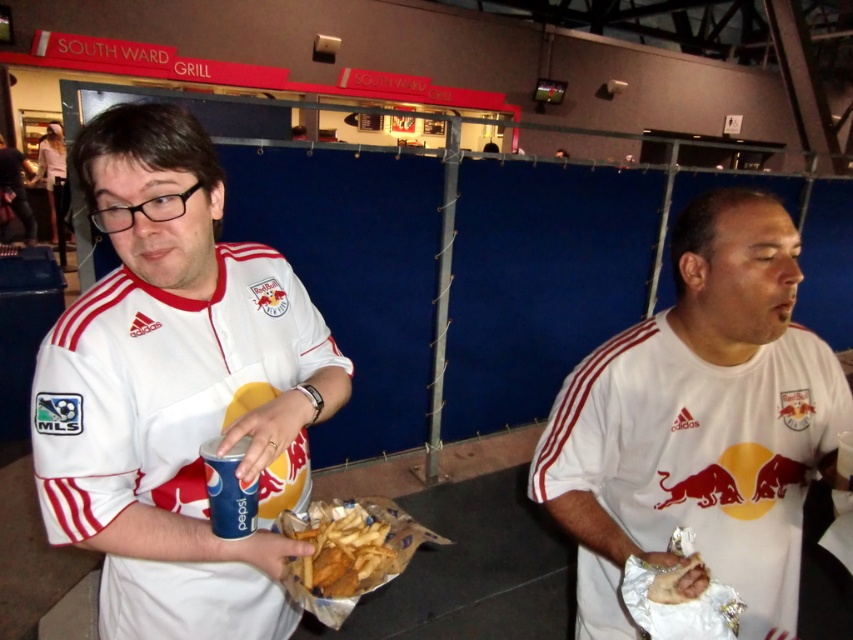
Question: Does white matte shirt at center appear over blue paper cup at left?

Choices:
 (A) yes
 (B) no

Answer: (B)

Question: Can you confirm if white matte shirt at center is positioned to the left of blue paper cup at left?

Choices:
 (A) no
 (B) yes

Answer: (A)

Question: Among these objects, which one is nearest to the camera?

Choices:
 (A) white matte shirt at center
 (B) white matte jersey at center
 (C) golden crispy fries at center
 (D) blue paper cup at left

Answer: (D)

Question: Among these objects, which one is nearest to the camera?

Choices:
 (A) white matte jersey at center
 (B) blue paper cup at left

Answer: (B)

Question: Can you confirm if white matte jersey at center is bigger than blue paper cup at left?

Choices:
 (A) no
 (B) yes

Answer: (B)

Question: Among these objects, which one is nearest to the camera?

Choices:
 (A) white matte shirt at center
 (B) golden crispy fries at center
 (C) white matte jersey at center

Answer: (C)